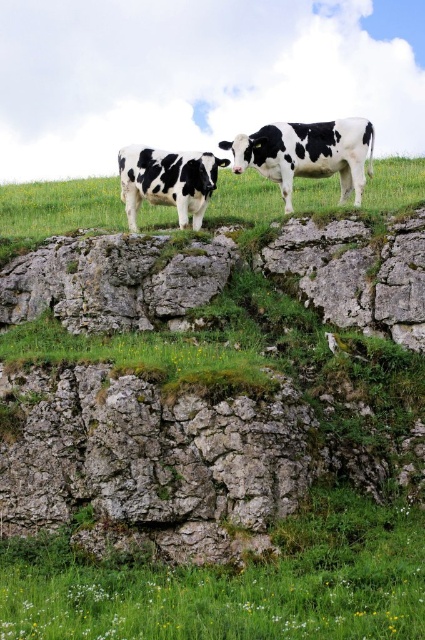
This screenshot has width=425, height=640. Find the location of `black-and-white cow at center`. black-and-white cow at center is located at coordinates (308, 154).

This screenshot has width=425, height=640. What are the coordinates of `black-and-white cow at center` in the screenshot? It's located at (308, 154).